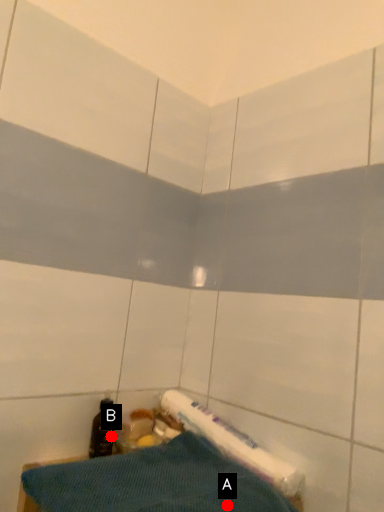
Question: Two points are circled on the image, labeled by A and B beside each circle. Which point is closer to the camera?

Choices:
 (A) A is closer
 (B) B is closer

Answer: (A)